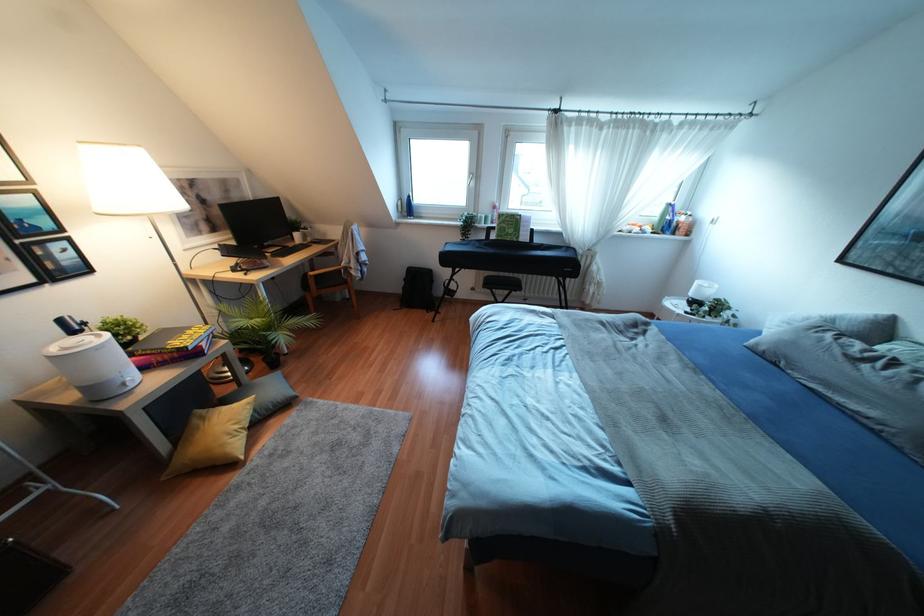
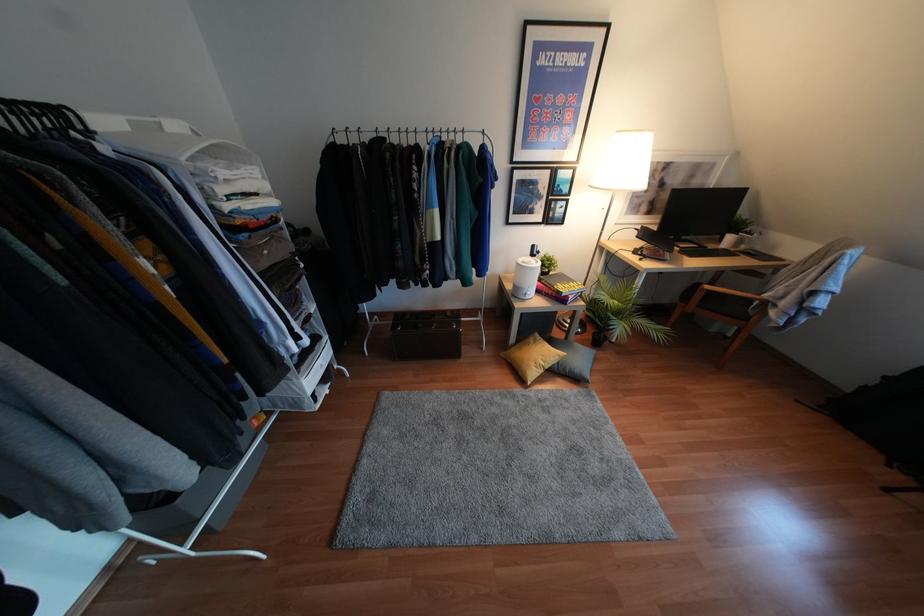
Where in the second image is the point corresponding to (x=188, y=331) from the first image?

(570, 283)